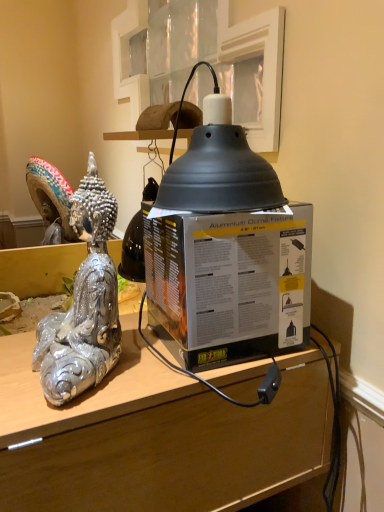
Question: Is matte black box at center located outside matte black dome at upper center?

Choices:
 (A) yes
 (B) no

Answer: (A)

Question: Does matte black box at center have a greater width compared to matte black dome at upper center?

Choices:
 (A) no
 (B) yes

Answer: (B)

Question: Does matte black box at center have a larger size compared to matte black dome at upper center?

Choices:
 (A) yes
 (B) no

Answer: (A)

Question: Can you confirm if matte black box at center is smaller than matte black dome at upper center?

Choices:
 (A) no
 (B) yes

Answer: (A)

Question: From a real-world perspective, is matte black box at center on top of matte black dome at upper center?

Choices:
 (A) no
 (B) yes

Answer: (A)

Question: Is matte black box at center to the left of matte black dome at upper center from the viewer's perspective?

Choices:
 (A) no
 (B) yes

Answer: (A)

Question: Can you confirm if matte black box at center is positioned to the right of matte black box at center?

Choices:
 (A) yes
 (B) no

Answer: (A)

Question: Is matte black box at center positioned before matte black box at center?

Choices:
 (A) no
 (B) yes

Answer: (A)

Question: Is matte black box at center oriented towards matte black box at center?

Choices:
 (A) yes
 (B) no

Answer: (B)

Question: Is the depth of matte black box at center greater than that of matte black box at center?

Choices:
 (A) yes
 (B) no

Answer: (A)

Question: Does matte black box at center have a greater width compared to matte black box at center?

Choices:
 (A) no
 (B) yes

Answer: (A)

Question: Does matte black box at center have a larger size compared to matte black box at center?

Choices:
 (A) no
 (B) yes

Answer: (A)

Question: Can we say matte black dome at upper center lies outside matte black box at center?

Choices:
 (A) yes
 (B) no

Answer: (A)